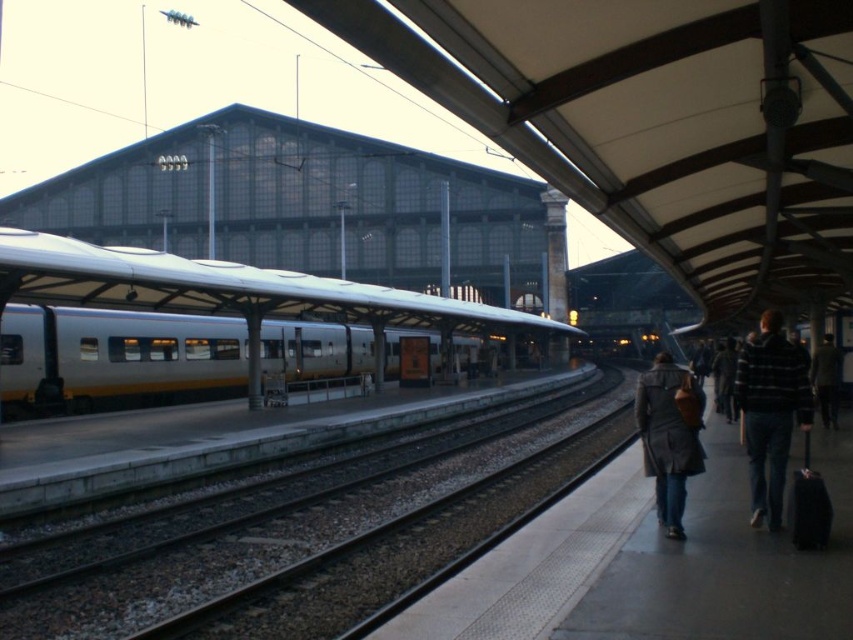
Question: Can you confirm if silver metallic train at center is wider than striped sweater at right?

Choices:
 (A) yes
 (B) no

Answer: (A)

Question: Among these objects, which one is nearest to the camera?

Choices:
 (A) striped sweater at right
 (B) dark gray coat at lower right
 (C) yellowmetallictrain track at center

Answer: (A)

Question: Is yellowmetallictrain track at center thinner than striped sweater at right?

Choices:
 (A) yes
 (B) no

Answer: (B)

Question: Which object is farther from the camera taking this photo?

Choices:
 (A) striped sweater at right
 (B) dark brown leather jacket at lower right

Answer: (B)

Question: Which object appears closest to the camera in this image?

Choices:
 (A) yellowmetallictrain track at center
 (B) dark gray coat at lower right
 (C) dark brown leather jacket at lower right
 (D) striped sweater at right

Answer: (D)

Question: Is striped sweater at right positioned at the back of dark brown leather jacket at lower right?

Choices:
 (A) no
 (B) yes

Answer: (A)